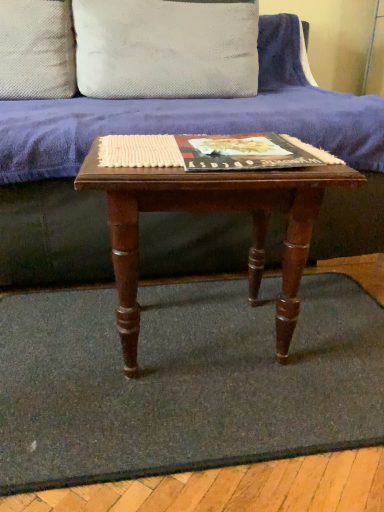
This screenshot has height=512, width=384. Describe the element at coordinates (211, 210) in the screenshot. I see `wooden table at center` at that location.

This screenshot has width=384, height=512. Identify the location of wooden table at center. (211, 210).

Identify the location of matte hardcover book at center. (245, 152).

In the scene shown: How much space does white textured pillow at upper center, which is the first pillow in right-to-left order, occupy vertically?

white textured pillow at upper center, which is the first pillow in right-to-left order, is 13.03 inches in height.

The width and height of the screenshot is (384, 512). I want to click on white dotted fabric pillow at upper center, acting as the first pillow starting from the left, so pos(37,49).

The height and width of the screenshot is (512, 384). I want to click on velvet purple couch at center, so click(x=52, y=234).

At what (x,y) coordinates should I click in order to perform the action: click on gray carpet at center. Please return your answer as a coordinate pair (x, y). Image resolution: width=384 pixels, height=512 pixels. Looking at the image, I should click on (183, 381).

Considering the points (33, 47) and (234, 187), which point is behind, point (33, 47) or point (234, 187)?

The point (33, 47) is farther from the camera.

Considering the relative positions of white dotted fabric pillow at upper center, acting as the first pillow starting from the left, and wooden table at center in the image provided, is white dotted fabric pillow at upper center, acting as the first pillow starting from the left, to the left of wooden table at center from the viewer's perspective?

Indeed, white dotted fabric pillow at upper center, acting as the first pillow starting from the left, is positioned on the left side of wooden table at center.

Is wooden table at center surrounded by white dotted fabric pillow at upper center, acting as the first pillow starting from the left?

Definitely not — wooden table at center is not inside white dotted fabric pillow at upper center, acting as the first pillow starting from the left.

The width and height of the screenshot is (384, 512). I want to click on the 1st pillow above the wooden table at center (from the image's perspective), so click(37, 49).

Is gray carpet at center oriented away from wooden table at center?

That's not correct — gray carpet at center is not looking away from wooden table at center.

Identify the location of doormat that appears below the wooden table at center (from the image's perspective). (183, 381).

From the image's perspective, is velvet purple couch at center positioned above or below white dotted fabric pillow at upper center, positioned as the second pillow in right-to-left order?

velvet purple couch at center is below white dotted fabric pillow at upper center, positioned as the second pillow in right-to-left order.

Is point (38, 265) farther from camera compared to point (6, 47)?

No, it is not.

Who is more distant, velvet purple couch at center or white dotted fabric pillow at upper center, acting as the first pillow starting from the left?

Positioned behind is white dotted fabric pillow at upper center, acting as the first pillow starting from the left.

Considering the relative sizes of velvet purple couch at center and white dotted fabric pillow at upper center, acting as the first pillow starting from the left, in the image provided, is velvet purple couch at center smaller than white dotted fabric pillow at upper center, acting as the first pillow starting from the left,?

No, velvet purple couch at center is not smaller than white dotted fabric pillow at upper center, acting as the first pillow starting from the left.

Is white textured pillow at upper center, which ranks as the second pillow in left-to-right order, to the left of gray carpet at center from the viewer's perspective?

Correct, you'll find white textured pillow at upper center, which ranks as the second pillow in left-to-right order, to the left of gray carpet at center.

Which point is more forward, (x=172, y=19) or (x=63, y=479)?

The point (x=63, y=479) is more forward.

Who is bigger, white textured pillow at upper center, which is the first pillow in right-to-left order, or gray carpet at center?

white textured pillow at upper center, which is the first pillow in right-to-left order.

This screenshot has width=384, height=512. Identify the location of doormat on the right side of white textured pillow at upper center, which ranks as the second pillow in left-to-right order. (183, 381).

Does point (232, 196) appear closer or farther from the camera than point (29, 202)?

Point (232, 196).

From a real-world perspective, relative to velvet purple couch at center, is wooden table at center vertically above or below?

wooden table at center is below velvet purple couch at center.

How different are the orientations of wooden table at center and velvet purple couch at center in degrees?

There is a 2.83-degree angle between the facing directions of wooden table at center and velvet purple couch at center.

Relative to velvet purple couch at center, is wooden table at center in front or behind?

In the image, wooden table at center appears in front of velvet purple couch at center.

Is white textured pillow at upper center, which ranks as the second pillow in left-to-right order, surrounded by gray carpet at center?

No, white textured pillow at upper center, which ranks as the second pillow in left-to-right order, is not surrounded by gray carpet at center.

This screenshot has width=384, height=512. I want to click on pillow that is the 2nd one above the gray carpet at center (from a real-world perspective), so click(x=166, y=48).

Which point is more distant from viewer, (36, 368) or (78, 13)?

The point (78, 13) is more distant.

Does gray carpet at center have a lesser width compared to white textured pillow at upper center, which is the first pillow in right-to-left order?

No, gray carpet at center is not thinner than white textured pillow at upper center, which is the first pillow in right-to-left order.

Looking at this image, is white dotted fabric pillow at upper center, positioned as the second pillow in right-to-left order, turned away from velvet purple couch at center?

Correct, white dotted fabric pillow at upper center, positioned as the second pillow in right-to-left order, is looking away from velvet purple couch at center.

How much distance is there between white dotted fabric pillow at upper center, positioned as the second pillow in right-to-left order, and velvet purple couch at center?

white dotted fabric pillow at upper center, positioned as the second pillow in right-to-left order, and velvet purple couch at center are 27.92 inches apart from each other.

Would you consider white dotted fabric pillow at upper center, positioned as the second pillow in right-to-left order, to be distant from velvet purple couch at center?

No, white dotted fabric pillow at upper center, positioned as the second pillow in right-to-left order, is in close proximity to velvet purple couch at center.

From a real-world perspective, is white dotted fabric pillow at upper center, positioned as the second pillow in right-to-left order, positioned above or below velvet purple couch at center?

From a real-world perspective, white dotted fabric pillow at upper center, positioned as the second pillow in right-to-left order, is physically above velvet purple couch at center.

Image resolution: width=384 pixels, height=512 pixels. In order to click on table on the right of white dotted fabric pillow at upper center, acting as the first pillow starting from the left in this screenshot , I will do `click(211, 210)`.

This screenshot has width=384, height=512. I want to click on doormat in front of the wooden table at center, so click(x=183, y=381).

Looking at the image, which one is located closer to white textured pillow at upper center, which ranks as the second pillow in left-to-right order, wooden table at center or matte hardcover book at center?

Based on the image, matte hardcover book at center appears to be nearer to white textured pillow at upper center, which ranks as the second pillow in left-to-right order.

Which object lies further to the anchor point wooden table at center, white dotted fabric pillow at upper center, acting as the first pillow starting from the left, or white textured pillow at upper center, which ranks as the second pillow in left-to-right order?

white dotted fabric pillow at upper center, acting as the first pillow starting from the left, lies further to wooden table at center than the other object.

Based on their spatial positions, is white textured pillow at upper center, which ranks as the second pillow in left-to-right order, or wooden table at center closer to velvet purple couch at center?

Based on the image, wooden table at center appears to be nearer to velvet purple couch at center.

Based on their spatial positions, is velvet purple couch at center or matte hardcover book at center closer to white textured pillow at upper center, which is the first pillow in right-to-left order?

velvet purple couch at center lies closer to white textured pillow at upper center, which is the first pillow in right-to-left order, than the other object.

Based on the photo, estimate the real-world distances between objects in this image. Which object is closer to wooden table at center, velvet purple couch at center or matte hardcover book at center?

Among the two, matte hardcover book at center is located nearer to wooden table at center.

Looking at the image, which one is located further to white dotted fabric pillow at upper center, acting as the first pillow starting from the left, velvet purple couch at center or matte hardcover book at center?

The object further to white dotted fabric pillow at upper center, acting as the first pillow starting from the left, is matte hardcover book at center.

Estimate the real-world distances between objects in this image. Which object is further from matte hardcover book at center, white dotted fabric pillow at upper center, positioned as the second pillow in right-to-left order, or gray carpet at center?

white dotted fabric pillow at upper center, positioned as the second pillow in right-to-left order.

When comparing their distances from matte hardcover book at center, does gray carpet at center or velvet purple couch at center seem closer?

velvet purple couch at center lies closer to matte hardcover book at center than the other object.

Identify the location of table between white dotted fabric pillow at upper center, positioned as the second pillow in right-to-left order, and gray carpet at center from top to bottom. This screenshot has height=512, width=384. (211, 210).

Find the location of a particular element. Image resolution: width=384 pixels, height=512 pixels. paperback book between wooden table at center and white dotted fabric pillow at upper center, acting as the first pillow starting from the left, in the front-back direction is located at coordinates (245, 152).

Find the location of a particular element. studio couch between white textured pillow at upper center, which ranks as the second pillow in left-to-right order, and gray carpet at center vertically is located at coordinates (52, 234).

Locate an element on the screen. Image resolution: width=384 pixels, height=512 pixels. pillow between velvet purple couch at center and white textured pillow at upper center, which ranks as the second pillow in left-to-right order, in the front-back direction is located at coordinates (x=37, y=49).